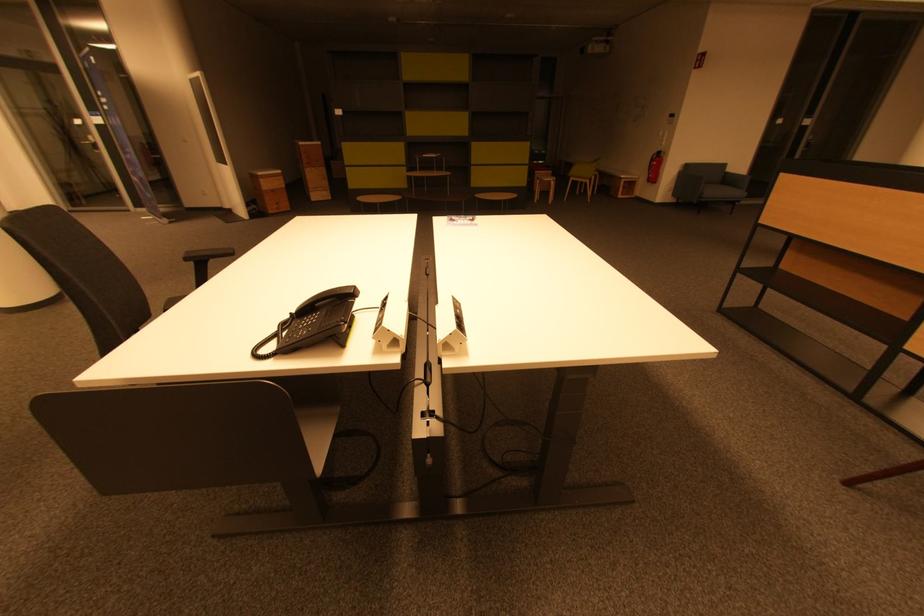
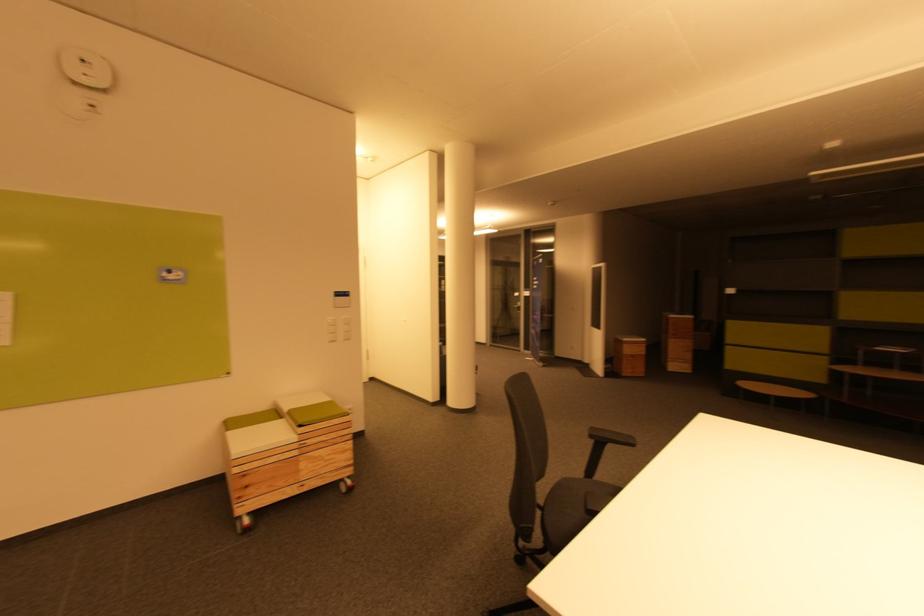
Question: The camera is either moving clockwise (left) or counter-clockwise (right) around the object. The first image is from the beginning of the video and the second image is from the end. Is the camera moving left or right when shooting the video?

Choices:
 (A) Left
 (B) Right

Answer: (B)